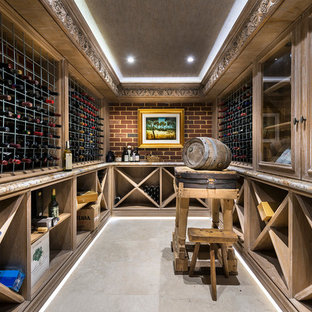
Locate an element on the screen. The image size is (312, 312). table leg is located at coordinates (177, 215), (181, 216), (215, 211), (227, 218).